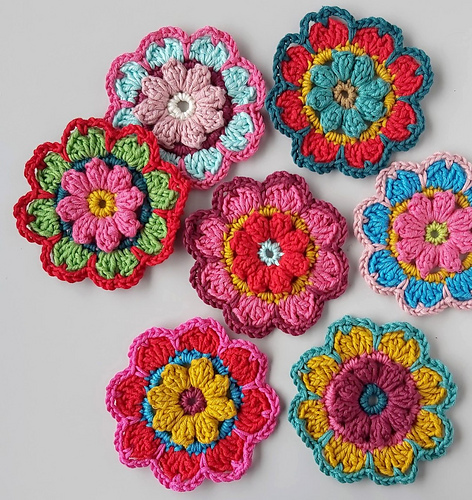
You are a GUI agent. You are given a task and a screenshot of the screen. Output one action in this format:
    pyautogui.click(x=<x>, y=<y>)
    Task: Click on the yarn art
    
    Given the screenshot: What is the action you would take?
    pyautogui.click(x=401, y=420)